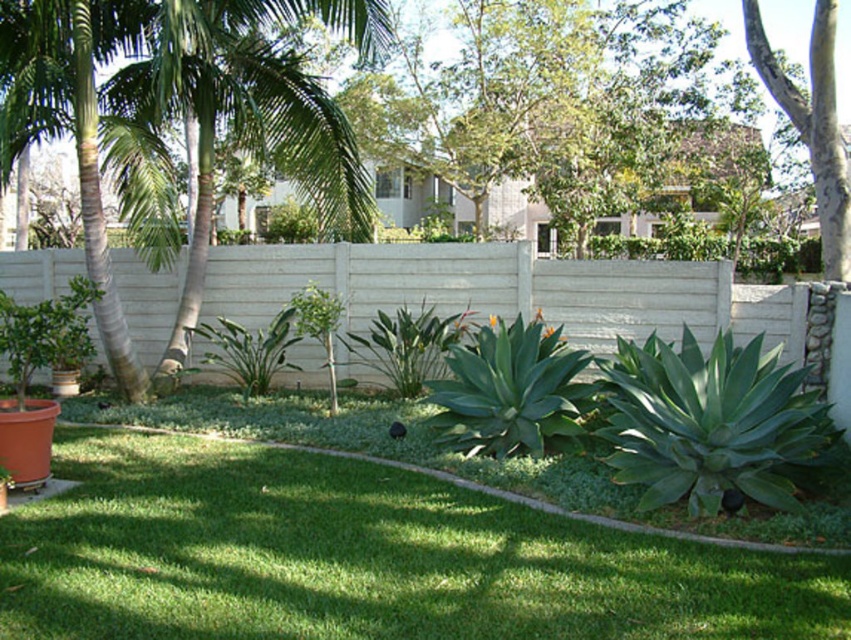
Does green grass at center appear under smooth gray bark tree at upper right?

Yes.

Is green grass at center closer to the viewer compared to smooth gray bark tree at upper right?

Yes, it is in front of smooth gray bark tree at upper right.

Identify the location of green grass at center. (363, 557).

Measure the distance between green grass at center and camera.

green grass at center is 3.58 meters away from camera.

Can you confirm if green grass at center is positioned to the right of green leafy palm tree at left?

Correct, you'll find green grass at center to the right of green leafy palm tree at left.

Is point (163, 616) more distant than point (320, 173)?

No, it is in front of (320, 173).

The width and height of the screenshot is (851, 640). Find the location of `green grass at center`. green grass at center is located at coordinates (363, 557).

Is green leafy palm tree at left above smooth gray bark tree at upper right?

Actually, green leafy palm tree at left is below smooth gray bark tree at upper right.

This screenshot has height=640, width=851. Identify the location of green leafy palm tree at left. (249, 115).